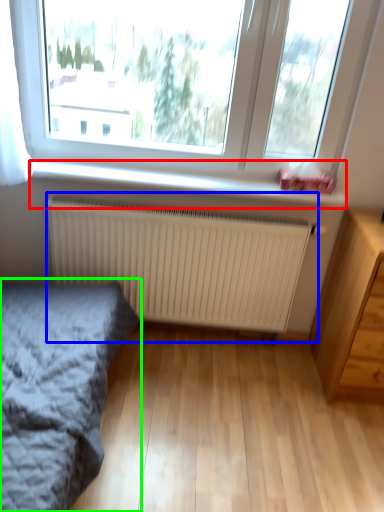
Question: Which is farther away from window sill (highlighted by a red box)? radiator (highlighted by a blue box) or bed (highlighted by a green box)?

Choices:
 (A) radiator
 (B) bed

Answer: (B)